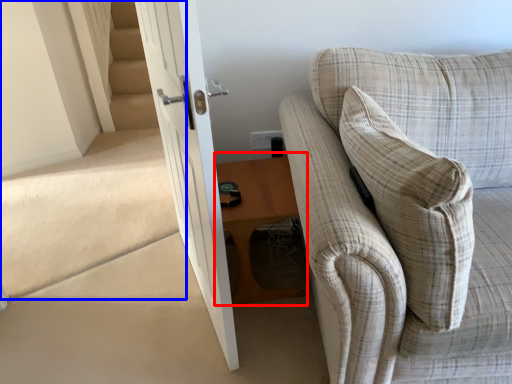
Question: Which of the following is the closest to the observer, table (highlighted by a red box) or stairwell (highlighted by a blue box)?

Choices:
 (A) table
 (B) stairwell

Answer: (B)